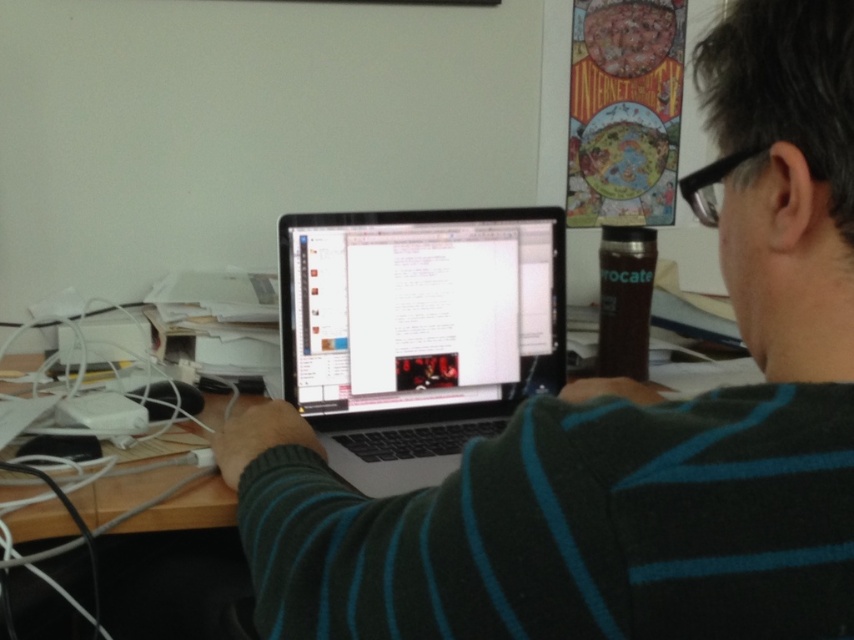
Question: Among these objects, which one is nearest to the camera?

Choices:
 (A) black matte laptop at center
 (B) sleek silver laptop at center

Answer: (A)

Question: Which object is the farthest from the sleek silver laptop at center?

Choices:
 (A) wooden at center
 (B) black matte laptop at center

Answer: (B)

Question: In this image, where is black matte laptop at center located relative to wooden at center?

Choices:
 (A) above
 (B) below

Answer: (A)

Question: Does black matte laptop at center come behind sleek silver laptop at center?

Choices:
 (A) yes
 (B) no

Answer: (B)

Question: Which point appears farthest from the camera in this image?

Choices:
 (A) (x=712, y=368)
 (B) (x=755, y=548)

Answer: (A)

Question: Is sleek silver laptop at center to the right of wooden at center from the viewer's perspective?

Choices:
 (A) yes
 (B) no

Answer: (A)